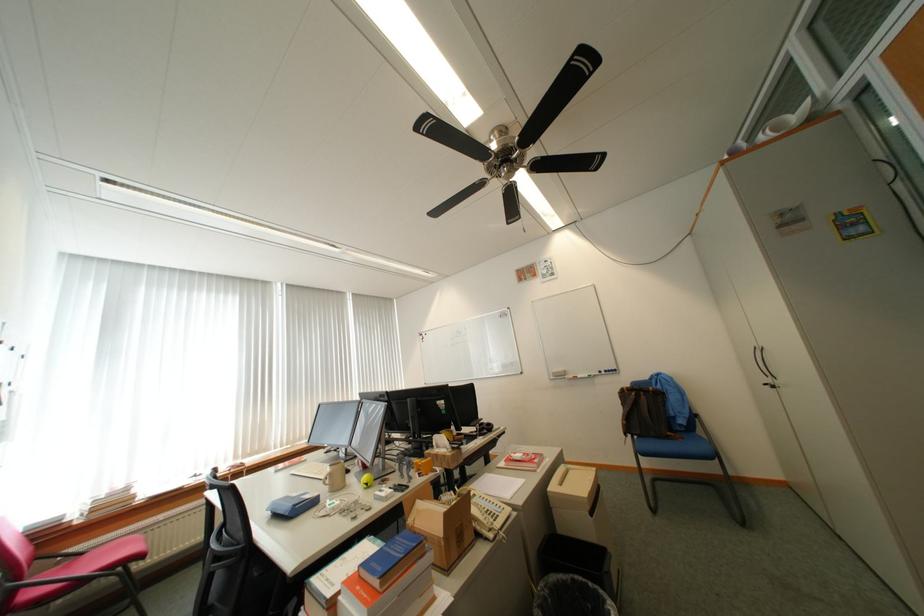
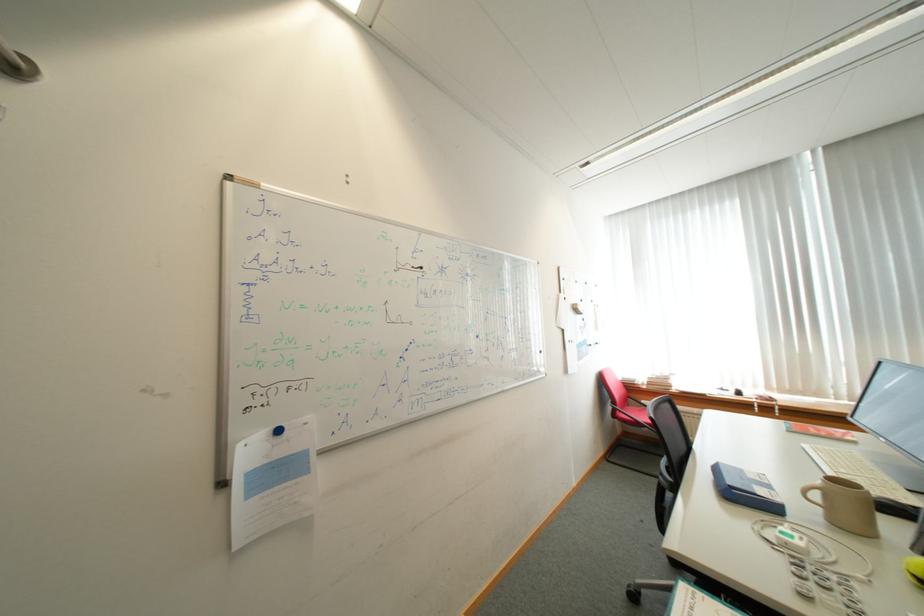
Question: How did the camera likely rotate?

Choices:
 (A) Left
 (B) Right
 (C) Up
 (D) Down

Answer: (A)